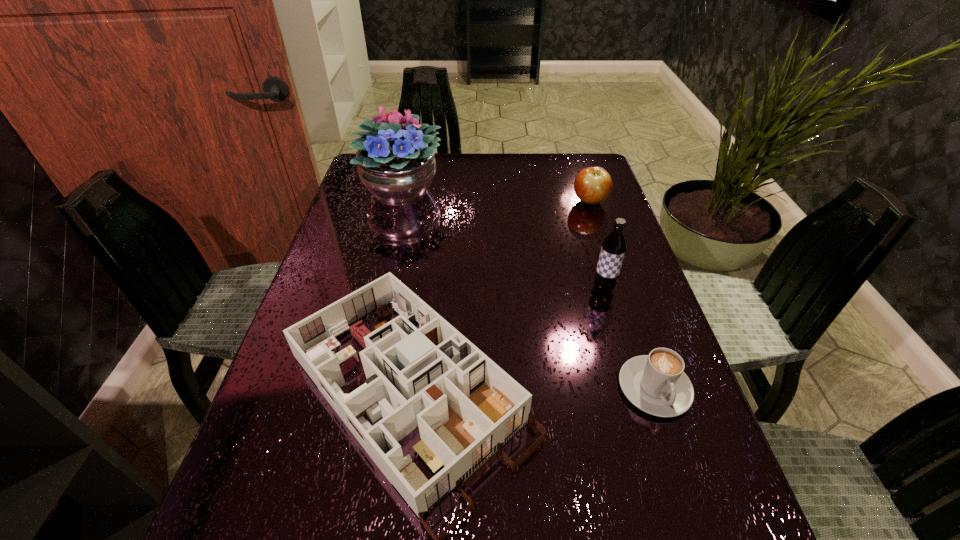
Where is `object located in the left edge section of the desktop`? Image resolution: width=960 pixels, height=540 pixels. object located in the left edge section of the desktop is located at coordinates (396, 162).

Find the location of a particular element. The height and width of the screenshot is (540, 960). root beer that is at the right edge is located at coordinates (613, 249).

You are a GUI agent. You are given a task and a screenshot of the screen. Output one action in this format:
    pyautogui.click(x=<x>, y=<y>)
    Task: Click on the apple that is at the right edge
    The height and width of the screenshot is (540, 960).
    Given the screenshot: What is the action you would take?
    pyautogui.click(x=592, y=185)

At what (x,y) coordinates should I click in order to perform the action: click on cappuccino present at the right edge. Please return your answer as a coordinate pair (x, y). Looking at the image, I should click on (656, 383).

The image size is (960, 540). I want to click on object at the far left corner, so [396, 162].

Where is `vacant position at the far edge of the desktop`? This screenshot has width=960, height=540. vacant position at the far edge of the desktop is located at coordinates (449, 177).

Where is `vacant space at the left edge of the desktop`? The height and width of the screenshot is (540, 960). vacant space at the left edge of the desktop is located at coordinates (322, 258).

Image resolution: width=960 pixels, height=540 pixels. In the image, there is a desktop. In order to click on vacant space at the right edge in this screenshot , I will do `click(632, 259)`.

Image resolution: width=960 pixels, height=540 pixels. I want to click on vacant region between the apple and the tallest object, so click(x=495, y=196).

I want to click on free spot between the root beer and the cappuccino, so click(629, 338).